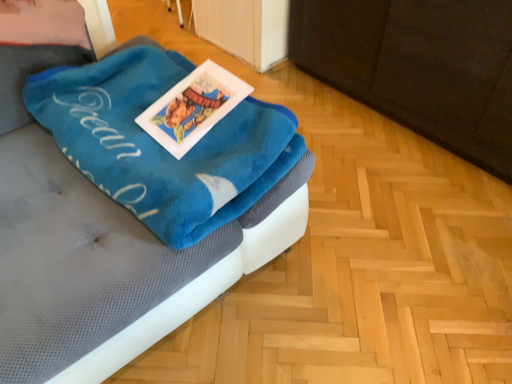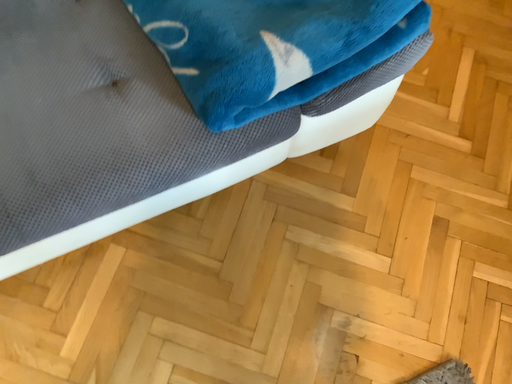
Question: Which way did the camera rotate in the video?

Choices:
 (A) rotated upward
 (B) rotated downward

Answer: (B)